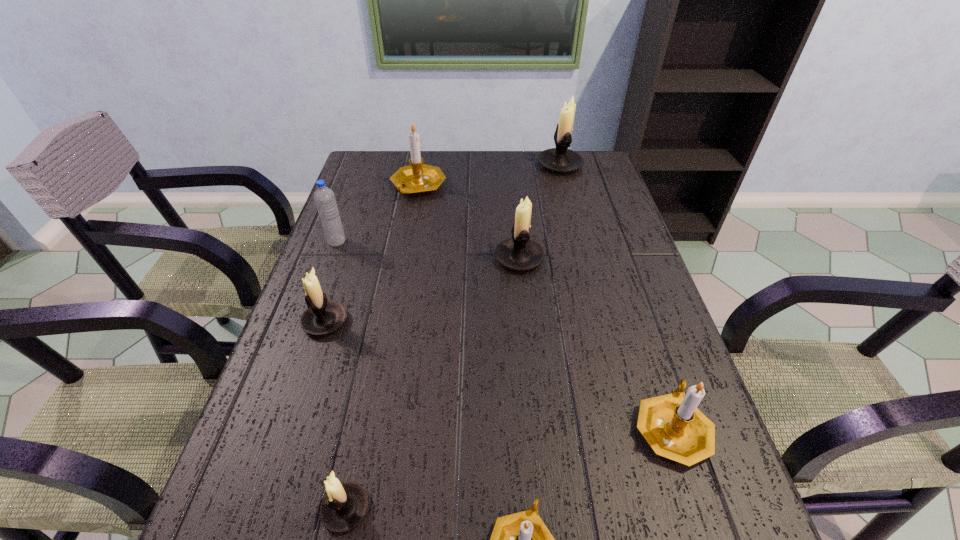
The image size is (960, 540). In order to click on object present at the near edge in this screenshot , I will do `click(345, 505)`.

Image resolution: width=960 pixels, height=540 pixels. In order to click on water bottle that is at the left edge in this screenshot , I will do `click(324, 197)`.

Where is `object positioned at the far left corner`? The height and width of the screenshot is (540, 960). object positioned at the far left corner is located at coordinates [417, 178].

Locate an element on the screen. object that is at the far right corner is located at coordinates (560, 159).

Identify the location of vacant space at the far edge of the desktop. (534, 179).

Locate an element on the screen. The height and width of the screenshot is (540, 960). vacant area at the left edge of the desktop is located at coordinates (226, 528).

This screenshot has height=540, width=960. In the image, there is a desktop. Identify the location of vacant region at the right edge. (591, 196).

Find the location of a particular element. Image resolution: width=960 pixels, height=540 pixels. vacant area that lies between the fifth farthest object and the third smallest white candle holder is located at coordinates (422, 289).

Identify the location of free spot between the fifth farthest object and the farthest white candle holder. The image size is (960, 540). (443, 243).

Where is `vacant region between the second white candle holder from right to left and the third white candle holder from right to left`? vacant region between the second white candle holder from right to left and the third white candle holder from right to left is located at coordinates (433, 383).